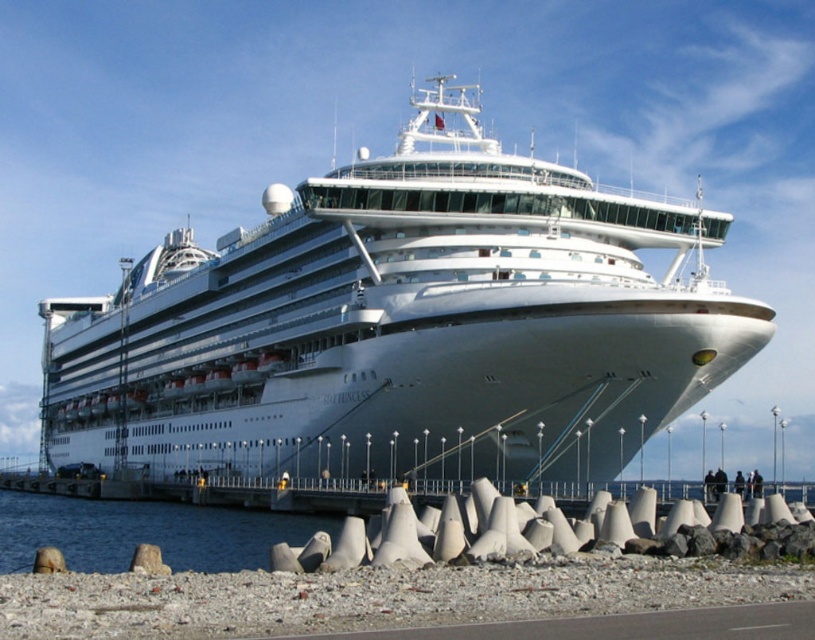
Can you confirm if white glossy cruise ship at center is shorter than clear water at lower left?

In fact, white glossy cruise ship at center may be taller than clear water at lower left.

Does white glossy cruise ship at center have a greater width compared to clear water at lower left?

Yes, white glossy cruise ship at center is wider than clear water at lower left.

Between point (692, 355) and point (86, 570), which one is positioned behind?

The point (692, 355) is behind.

At what (x,y) coordinates should I click in order to perform the action: click on white glossy cruise ship at center. Please return your answer as a coordinate pair (x, y). The width and height of the screenshot is (815, 640). Looking at the image, I should click on (402, 324).